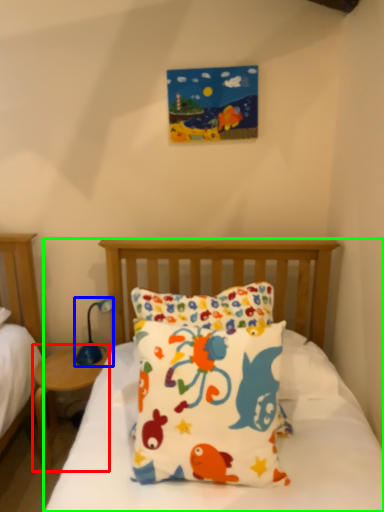
Question: Which object is the farthest from nightstand (highlighted by a red box)? Choose among these: table lamp (highlighted by a blue box) or bed (highlighted by a green box).

Choices:
 (A) table lamp
 (B) bed

Answer: (B)